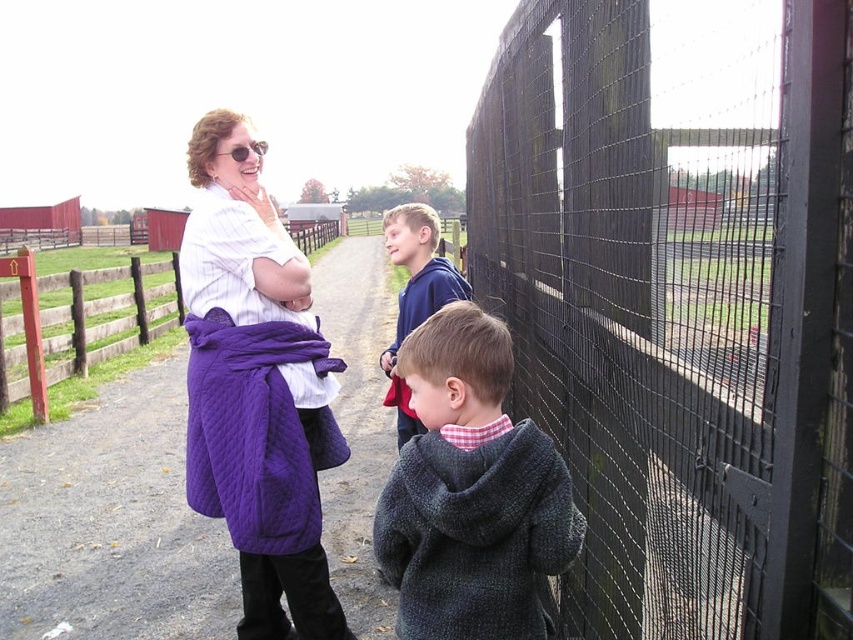
Measure the distance between point (677,500) and camera.

Point (677,500) is 4.69 feet away from camera.

Is black wire mesh fence at right below blue fleece jacket at center?

Actually, black wire mesh fence at right is above blue fleece jacket at center.

This screenshot has height=640, width=853. What are the coordinates of `black wire mesh fence at right` in the screenshot? It's located at (679, 316).

Where is `black wire mesh fence at right`? This screenshot has height=640, width=853. black wire mesh fence at right is located at coordinates (679, 316).

Which is in front, point (408, 540) or point (421, 280)?

Point (408, 540) is in front.

Who is shorter, dark gray knitted sweater at center or blue fleece jacket at center?

Standing shorter between the two is dark gray knitted sweater at center.

Is point (488, 388) farther from camera compared to point (416, 307)?

No, it is not.

I want to click on dark gray knitted sweater at center, so click(x=473, y=493).

Between purple quilted coat at center and purple quilted coat at left, which one is positioned lower?

purple quilted coat at center

The width and height of the screenshot is (853, 640). In order to click on purple quilted coat at center in this screenshot , I will do `click(256, 387)`.